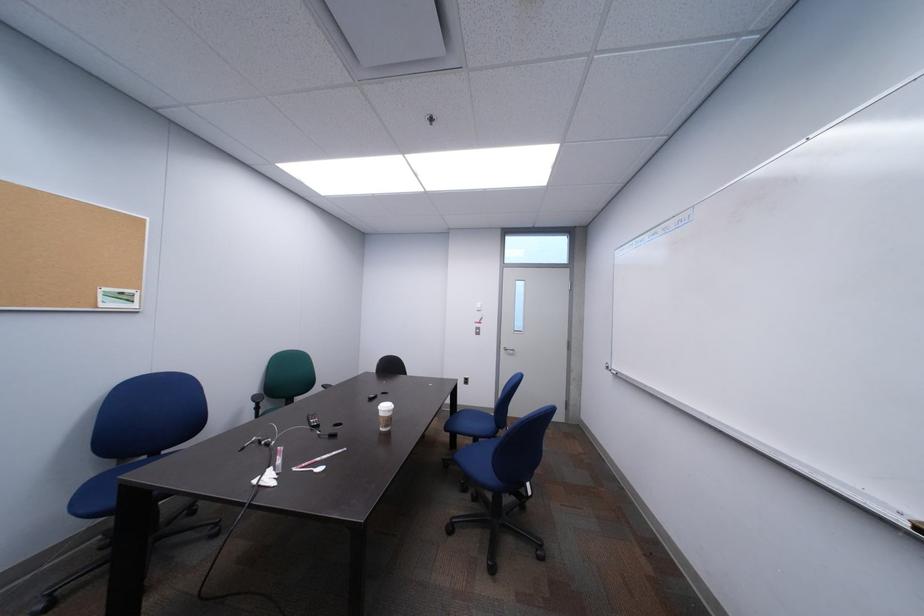
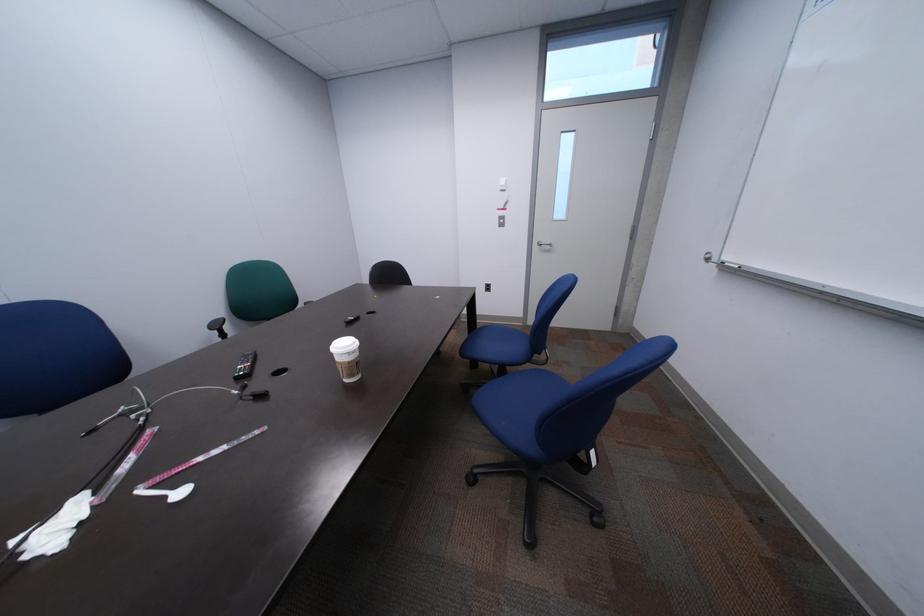
Question: How did the camera likely rotate?

Choices:
 (A) Left
 (B) Right
 (C) Up
 (D) Down

Answer: (D)